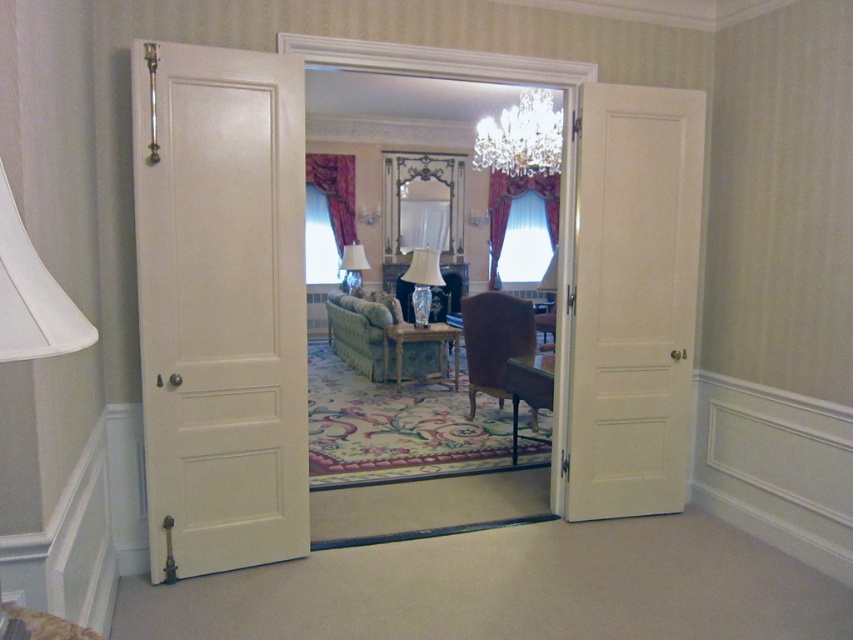
Question: Is white wood door at left above clear crystal chandelier at upper center?

Choices:
 (A) no
 (B) yes

Answer: (A)

Question: Estimate the real-world distances between objects in this image. Which object is farther from the clear crystal chandelier at upper center?

Choices:
 (A) brown velvet armchair at center
 (B) white matte door at right

Answer: (B)

Question: Among these objects, which one is farthest from the camera?

Choices:
 (A) white glossy lampshade at center
 (B) clear glass vase at center

Answer: (A)

Question: Which point is closer to the camera taking this photo?

Choices:
 (A) (669, 342)
 (B) (192, 93)
 (C) (351, 248)

Answer: (B)

Question: From the image, what is the correct spatial relationship of white wood door at left in relation to clear crystal chandelier at upper center?

Choices:
 (A) left
 (B) right

Answer: (A)

Question: Observing the image, what is the correct spatial positioning of white wood door at left in reference to green fabric armchair at center?

Choices:
 (A) below
 (B) above

Answer: (B)